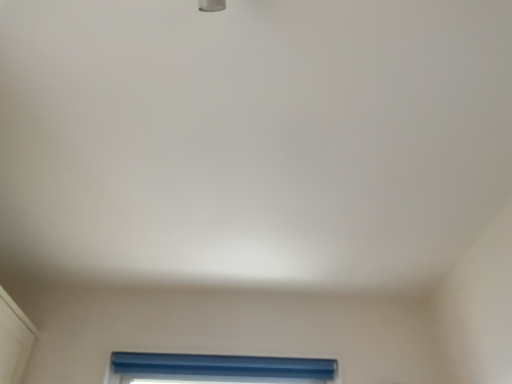
The image size is (512, 384). What do you see at coordinates (217, 369) in the screenshot? I see `blue matte window at lower center` at bounding box center [217, 369].

I want to click on blue matte window at lower center, so click(x=217, y=369).

At what (x,y) coordinates should I click in order to perform the action: click on blue matte window at lower center. Please return your answer as a coordinate pair (x, y). The image size is (512, 384). Looking at the image, I should click on (217, 369).